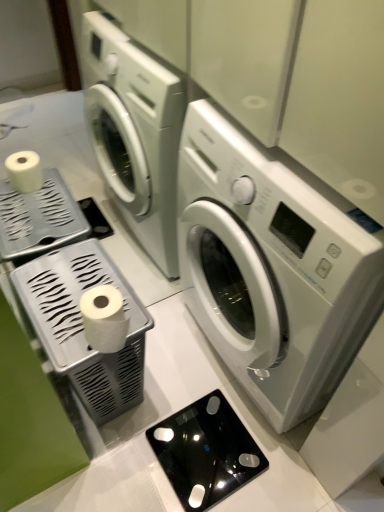
The width and height of the screenshot is (384, 512). I want to click on free space behind black glass scale at lower center, the 1th appliance in the right-to-left sequence, so click(x=187, y=371).